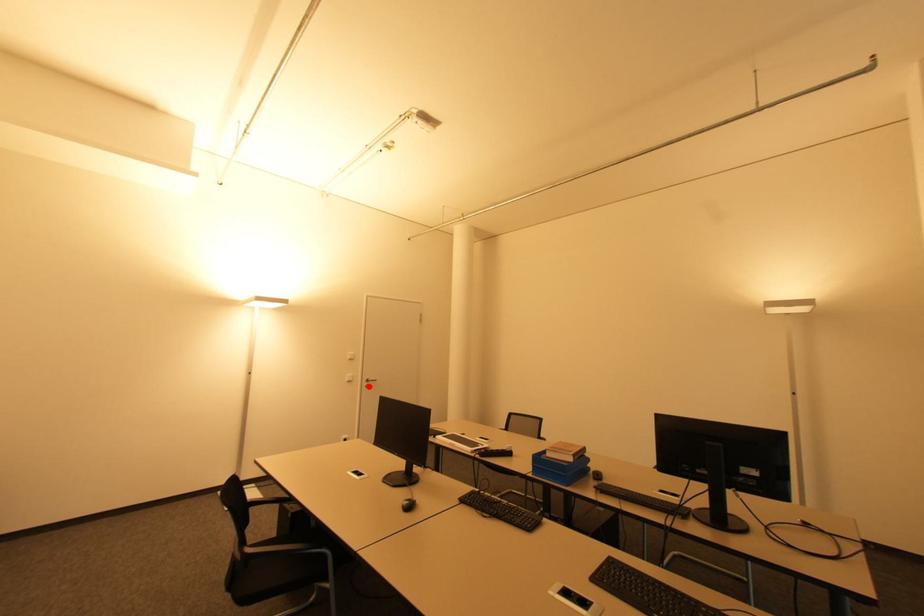
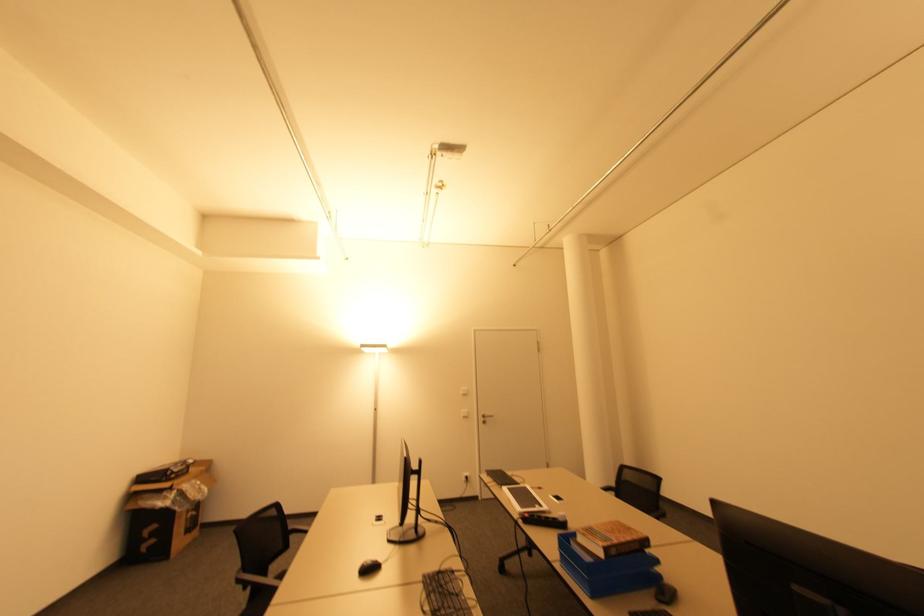
Locate, in the second image, the point that corresponds to the highlighted location in the first image.

(485, 422)